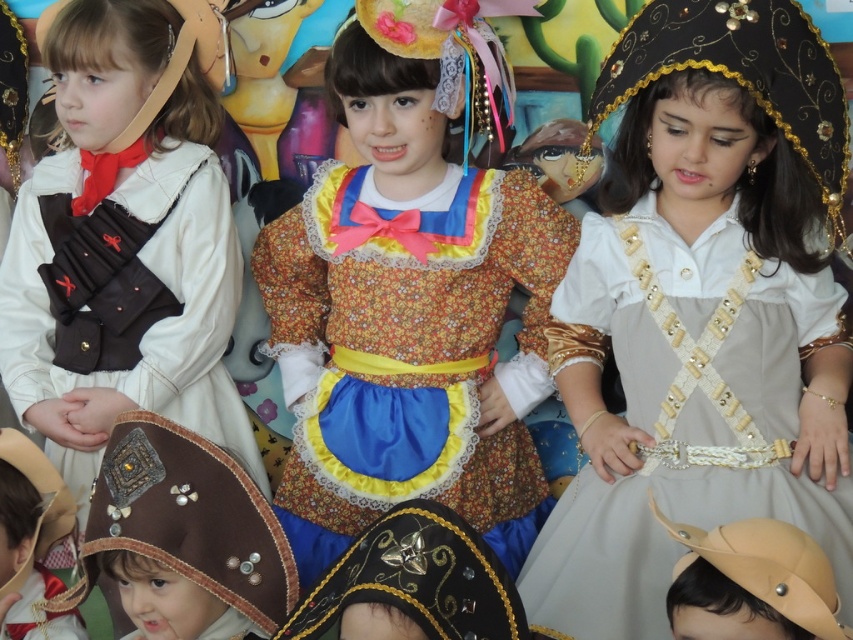
Question: Can you confirm if light beige satin dress at center is positioned below brown leather hat at lower left?

Choices:
 (A) no
 (B) yes

Answer: (A)

Question: Which point is closer to the camera?

Choices:
 (A) matte brown hat at lower left
 (B) black sequined headdress at upper right

Answer: (B)

Question: Which point is farther from the camera taking this photo?

Choices:
 (A) (683, 29)
 (B) (525, 13)
 (C) (62, 628)
 (D) (825, 321)

Answer: (B)

Question: Does floral fabric dress at center have a lesser width compared to brown leather hat at lower left?

Choices:
 (A) no
 (B) yes

Answer: (A)

Question: Which of the following is the farthest from the observer?

Choices:
 (A) (795, 316)
 (B) (18, 508)
 (C) (241, 515)
 (D) (74, 620)

Answer: (D)

Question: Is floral fabric dress at center below light beige satin dress at center?

Choices:
 (A) yes
 (B) no

Answer: (B)